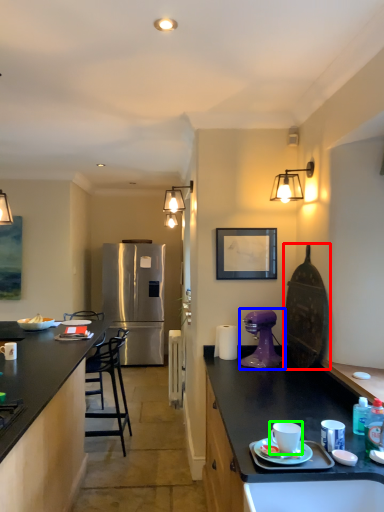
Question: Considering the real-world distances, which object is closest to appliance (highlighted by a red box)? coffee maker (highlighted by a blue box) or coffee cup (highlighted by a green box).

Choices:
 (A) coffee maker
 (B) coffee cup

Answer: (A)